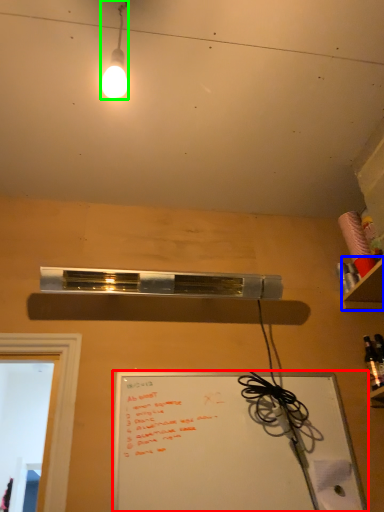
Question: Based on their relative distances, which object is nearer to whiteboard (highlighted by a red box)? Choose from shelf (highlighted by a blue box) and lamp (highlighted by a green box).

Choices:
 (A) shelf
 (B) lamp

Answer: (A)